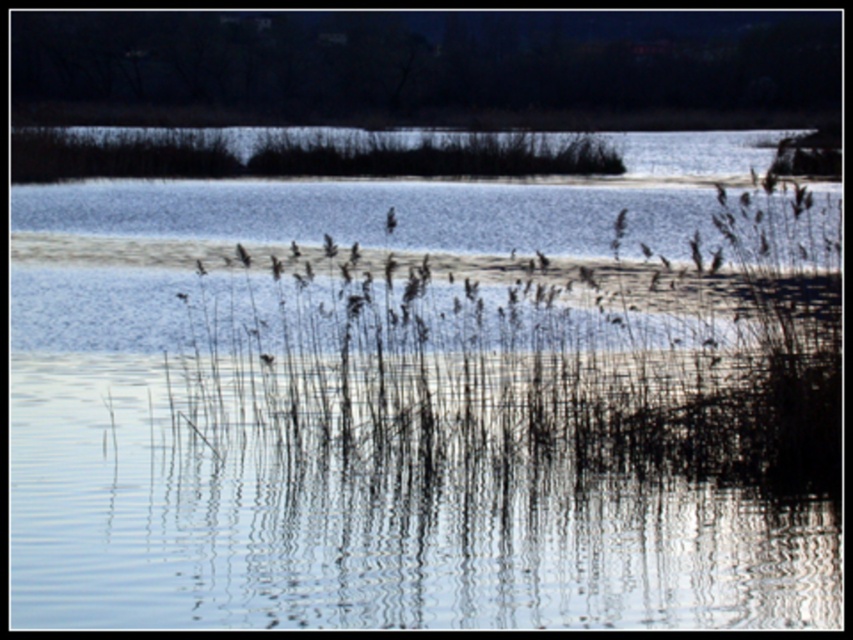
Question: Is clear water at center to the left of brown grass at center from the viewer's perspective?

Choices:
 (A) yes
 (B) no

Answer: (A)

Question: Considering the relative positions of clear water at center and brown grass at center in the image provided, where is clear water at center located with respect to brown grass at center?

Choices:
 (A) below
 (B) above

Answer: (A)

Question: Is clear water at center to the right of brown grass at center from the viewer's perspective?

Choices:
 (A) yes
 (B) no

Answer: (B)

Question: Which object appears closest to the camera in this image?

Choices:
 (A) clear water at center
 (B) brown grass at center

Answer: (B)

Question: Which of the following is the farthest from the observer?

Choices:
 (A) (219, 456)
 (B) (734, 378)

Answer: (A)